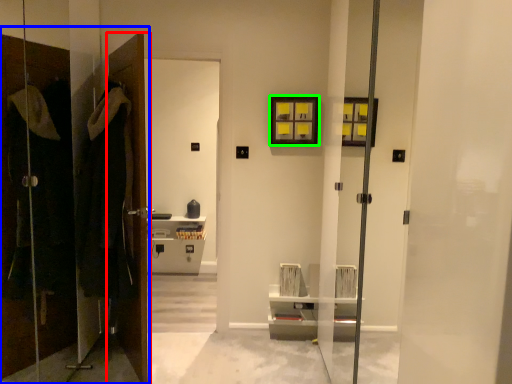
Question: Based on their relative distances, which object is farther from door (highlighted by a red box)? Choose from closet (highlighted by a blue box) and picture frame (highlighted by a green box).

Choices:
 (A) closet
 (B) picture frame

Answer: (B)